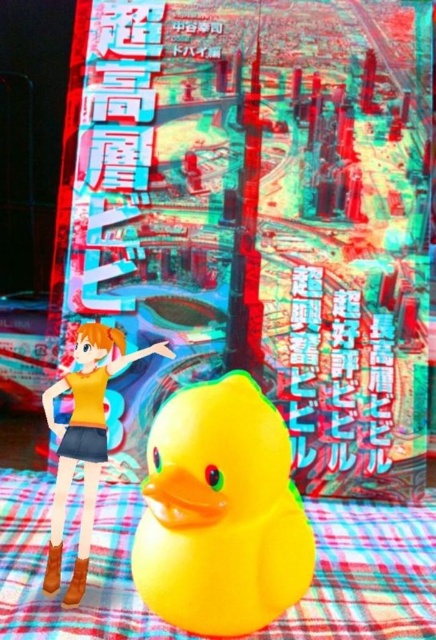
Consider the image. You are an artist trying to paint the scene. You need to know which object is wider to scale your drawing correctly. Which is wider, the yellow rubber duck at center or the matte yellow rubber duck at lower center?

The yellow rubber duck at center is wider than the matte yellow rubber duck at lower center according to the description.